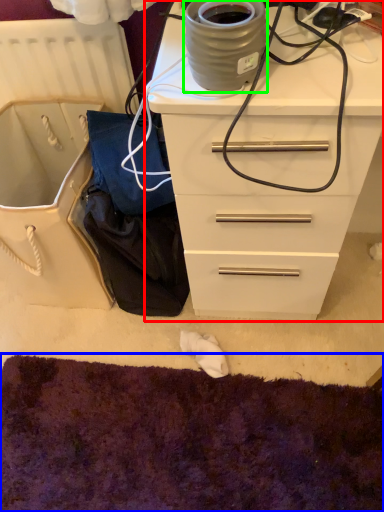
Question: Which object is positioned farthest from chest of drawers (highlighted by a red box)? Select from cat bed (highlighted by a blue box) and appliance (highlighted by a green box).

Choices:
 (A) cat bed
 (B) appliance

Answer: (A)